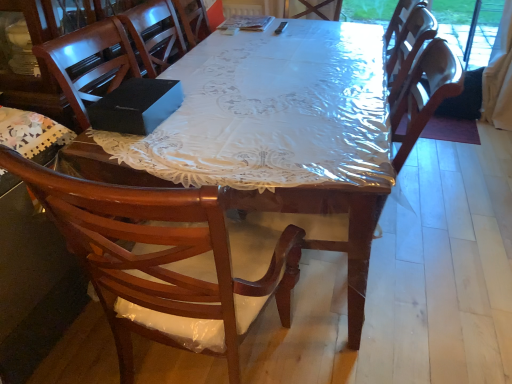
This screenshot has height=384, width=512. Find the location of `free space in front of wooden armchair at center`. free space in front of wooden armchair at center is located at coordinates (340, 355).